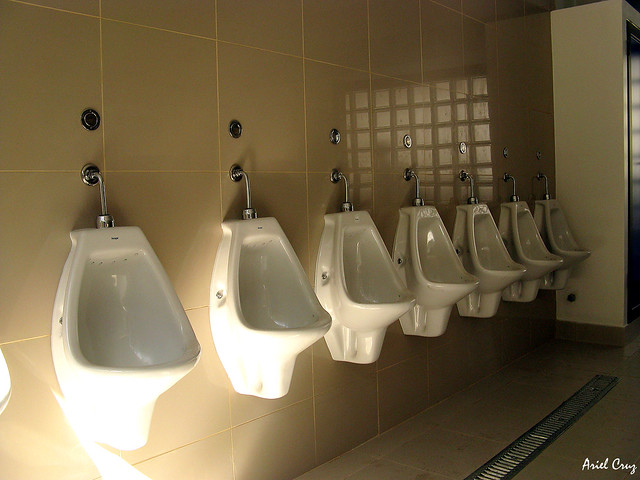
Identify the location of urinals. This screenshot has height=480, width=640. (572, 252), (543, 255), (486, 262), (449, 261), (356, 271), (269, 296), (109, 320), (6, 385).